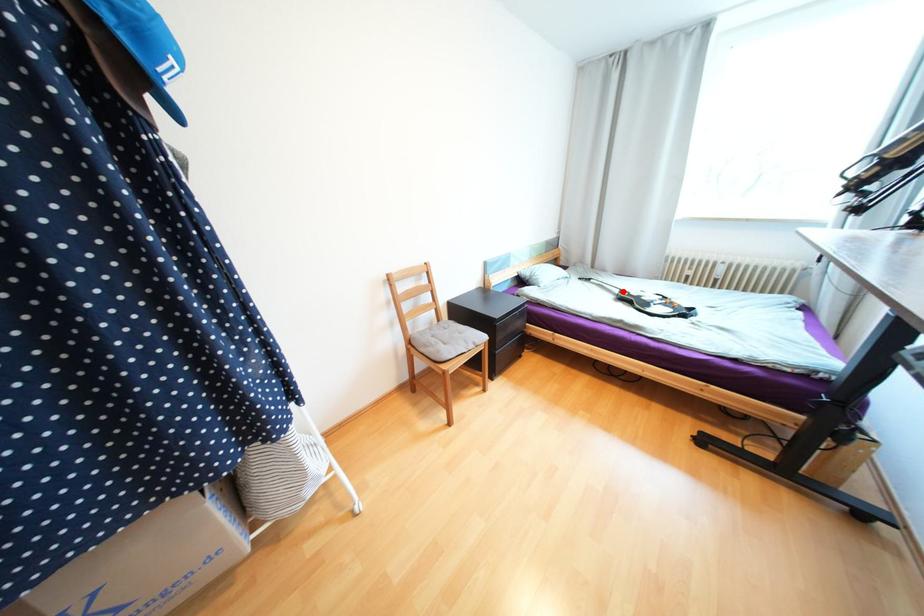
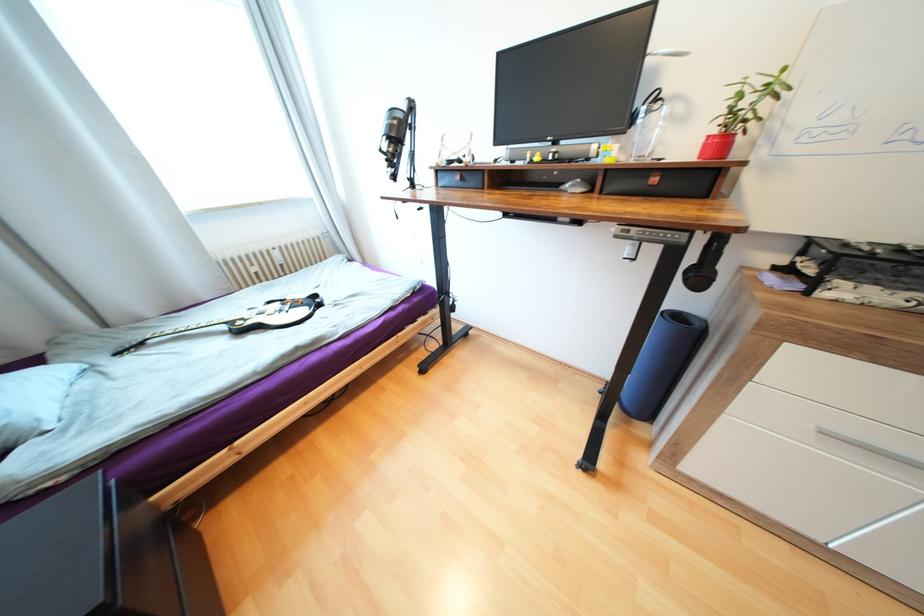
Where in the second image is the point corresponding to the highlighted location from the first image?

(229, 328)